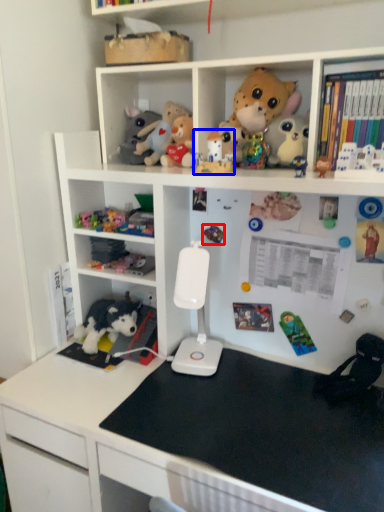
Question: Among these objects, which one is nearest to the camera, toy (highlighted by a red box) or toy (highlighted by a blue box)?

Choices:
 (A) toy
 (B) toy

Answer: (B)